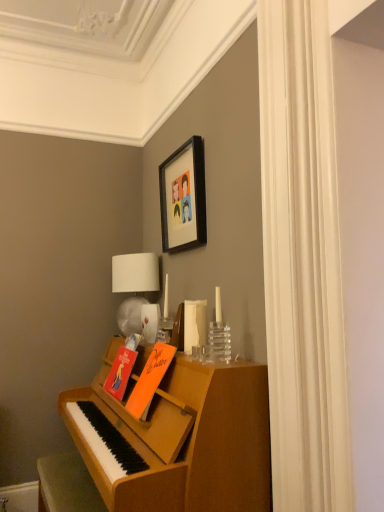
Question: From the image's perspective, is orange matte book at center, which is counted as the 1th book, starting from the front, above black matte picture frame at upper center?

Choices:
 (A) no
 (B) yes

Answer: (A)

Question: Is orange matte book at center, which is counted as the 1th book, starting from the front, oriented towards black matte picture frame at upper center?

Choices:
 (A) yes
 (B) no

Answer: (B)

Question: From a real-world perspective, is orange matte book at center, which is counted as the 1th book, starting from the front, physically above black matte picture frame at upper center?

Choices:
 (A) no
 (B) yes

Answer: (A)

Question: Is orange matte book at center, the second book positioned from the back, to the right of black matte picture frame at upper center from the viewer's perspective?

Choices:
 (A) no
 (B) yes

Answer: (A)

Question: Can you confirm if orange matte book at center, which is counted as the 1th book, starting from the front, is smaller than black matte picture frame at upper center?

Choices:
 (A) no
 (B) yes

Answer: (B)

Question: Is there a large distance between orange matte book at center, which is counted as the 1th book, starting from the front, and black matte picture frame at upper center?

Choices:
 (A) yes
 (B) no

Answer: (B)

Question: Can you confirm if orange matte book at center, the second book positioned from the back, is thinner than wooden piano at lower left?

Choices:
 (A) yes
 (B) no

Answer: (A)

Question: From the image's perspective, is orange matte book at center, the second book positioned from the back, located above wooden piano at lower left?

Choices:
 (A) no
 (B) yes

Answer: (B)

Question: Is orange matte book at center, the second book positioned from the back, behind wooden piano at lower left?

Choices:
 (A) no
 (B) yes

Answer: (B)

Question: From a real-world perspective, is orange matte book at center, which is counted as the 1th book, starting from the front, physically below wooden piano at lower left?

Choices:
 (A) yes
 (B) no

Answer: (B)

Question: Is wooden piano at lower left completely or partially inside orange matte book at center, the second book positioned from the back?

Choices:
 (A) no
 (B) yes

Answer: (A)

Question: Would you consider orange matte book at center, the second book positioned from the back, to be distant from wooden piano at lower left?

Choices:
 (A) yes
 (B) no

Answer: (B)

Question: Is wooden piano at lower left aimed at orange matte book at center, which appears as the 2th book when viewed from the front?

Choices:
 (A) no
 (B) yes

Answer: (A)